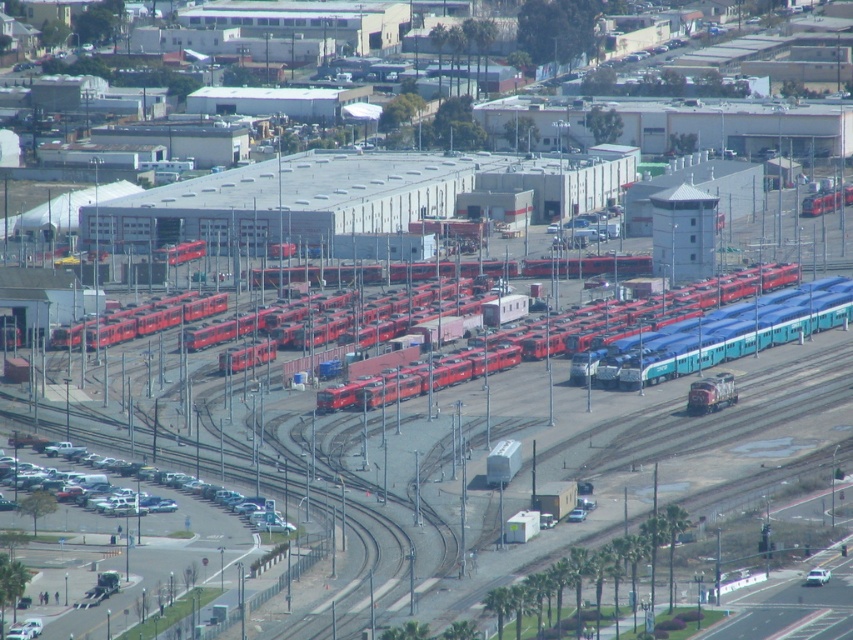
You are a train conductor who needs to identify the exact location of two trains in the rail yard. According to the scene, where is the matte red train at center in relation to the red glossy train at center?

The matte red train at center is located to the left of the red glossy train at center.